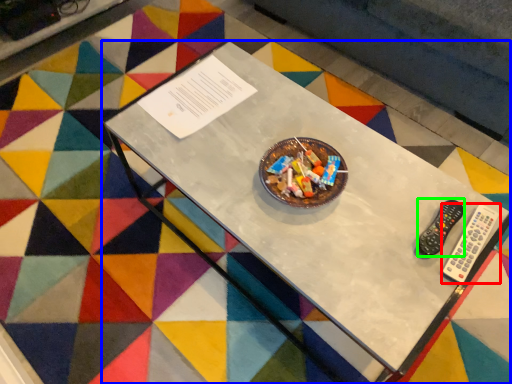
Question: Estimate the real-world distances between objects in this image. Which object is closer to remote control (highlighted by a red box), table (highlighted by a blue box) or control (highlighted by a green box)?

Choices:
 (A) table
 (B) control

Answer: (B)